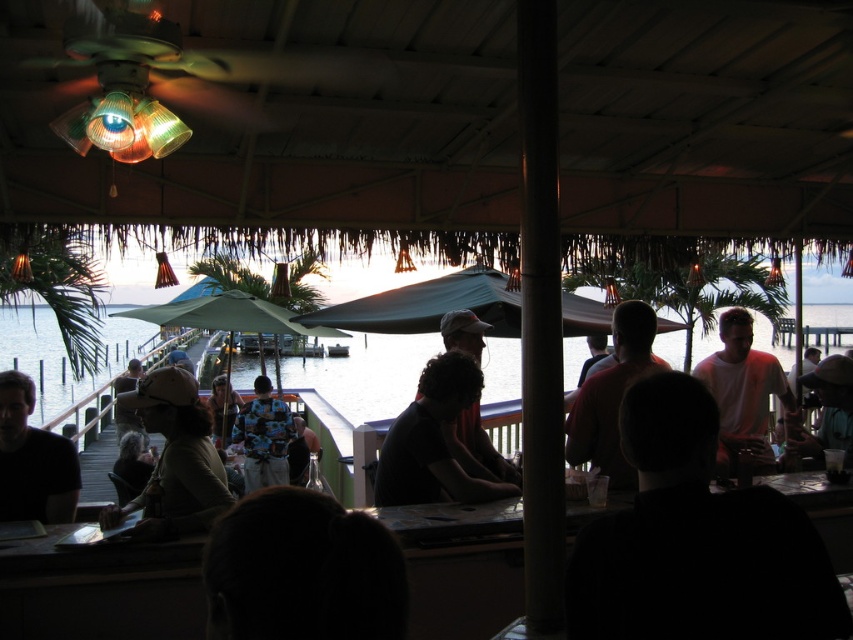
Can you confirm if white matte shirt at center is positioned to the left of clear water at center?

No, white matte shirt at center is not to the left of clear water at center.

Can you confirm if white matte shirt at center is wider than clear water at center?

No.

Is point (598, 534) behind point (390, 410)?

No, (598, 534) is in front of (390, 410).

Locate an element on the screen. This screenshot has height=640, width=853. white matte shirt at center is located at coordinates (695, 540).

Who is more distant from viewer, (775, 376) or (13, 497)?

A: The point (775, 376) is behind.

I want to click on white matte shirt at right, so click(743, 392).

Is point (747, 365) positioned in front of point (15, 472)?

No.

Find the location of a particular element. This screenshot has height=640, width=853. white matte shirt at right is located at coordinates (743, 392).

Which of these two, matte khaki cap at center or dark brown leather jacket at center, stands taller?

With more height is dark brown leather jacket at center.

Who is more distant from viewer, [160,483] or [448,385]?

The point [448,385] is behind.

Who is more forward, (167, 461) or (428, 358)?

Point (167, 461) is in front.

The height and width of the screenshot is (640, 853). I want to click on matte khaki cap at center, so click(x=173, y=460).